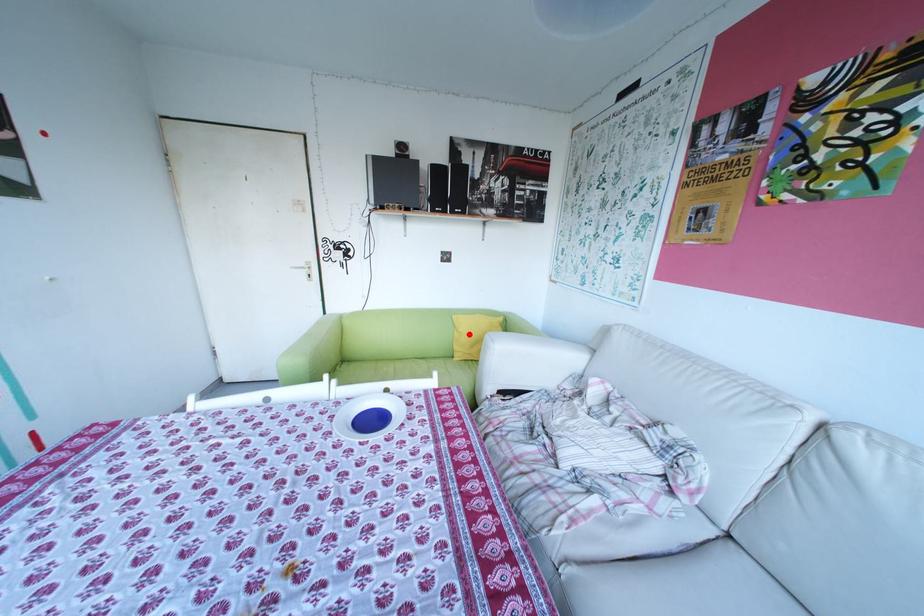
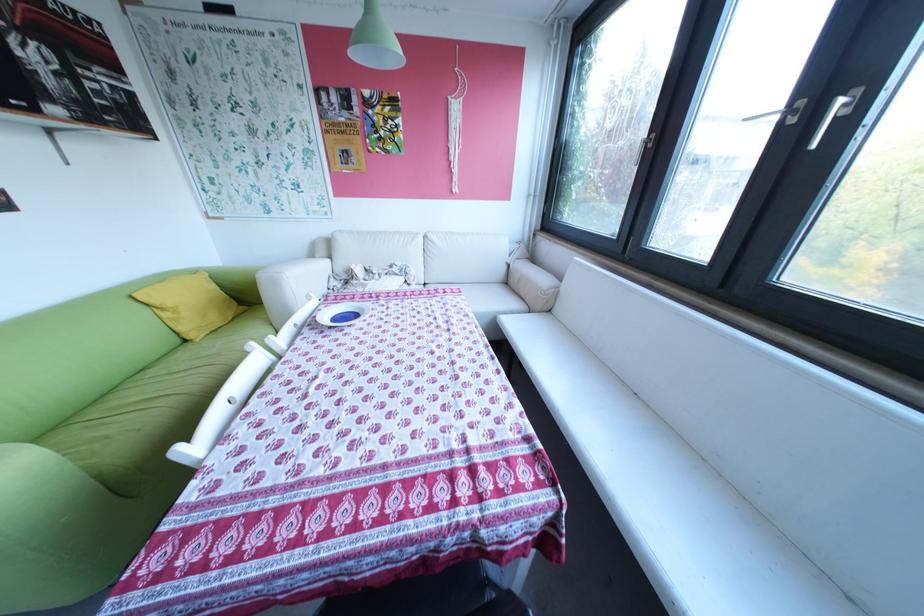
Locate, in the second image, the point that corresponds to the highlighted location in the first image.

(177, 314)